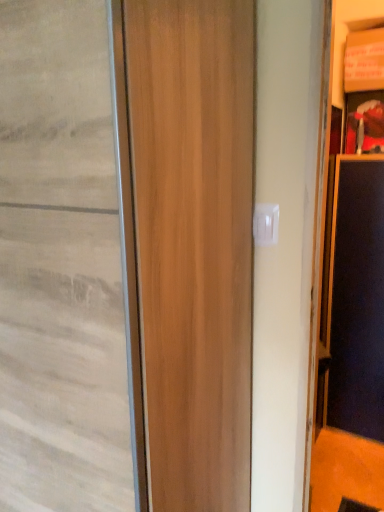
Question: Should I look upward or downward to see black matte screen door at right?

Choices:
 (A) down
 (B) up

Answer: (A)

Question: From the image's perspective, is black matte screen door at right above wooden door at center?

Choices:
 (A) no
 (B) yes

Answer: (A)

Question: Does black matte screen door at right lie behind wooden door at center?

Choices:
 (A) yes
 (B) no

Answer: (A)

Question: Can you confirm if black matte screen door at right is positioned to the right of wooden door at center?

Choices:
 (A) no
 (B) yes

Answer: (B)

Question: Can you confirm if black matte screen door at right is taller than wooden door at center?

Choices:
 (A) no
 (B) yes

Answer: (A)

Question: Considering the relative sizes of black matte screen door at right and wooden door at center in the image provided, is black matte screen door at right shorter than wooden door at center?

Choices:
 (A) yes
 (B) no

Answer: (A)

Question: Is black matte screen door at right to the left of wooden door at center from the viewer's perspective?

Choices:
 (A) no
 (B) yes

Answer: (A)

Question: Would you say wooden door at center contains black matte screen door at right?

Choices:
 (A) no
 (B) yes

Answer: (A)

Question: From a real-world perspective, is wooden door at center physically below black matte screen door at right?

Choices:
 (A) no
 (B) yes

Answer: (A)

Question: Is wooden door at center completely or partially outside of black matte screen door at right?

Choices:
 (A) yes
 (B) no

Answer: (A)

Question: Does wooden door at center lie in front of black matte screen door at right?

Choices:
 (A) no
 (B) yes

Answer: (B)

Question: Does wooden door at center have a larger size compared to black matte screen door at right?

Choices:
 (A) no
 (B) yes

Answer: (B)

Question: From the image's perspective, is wooden door at center under black matte screen door at right?

Choices:
 (A) yes
 (B) no

Answer: (B)

Question: Does point (380, 206) appear closer or farther from the camera than point (74, 403)?

Choices:
 (A) farther
 (B) closer

Answer: (A)